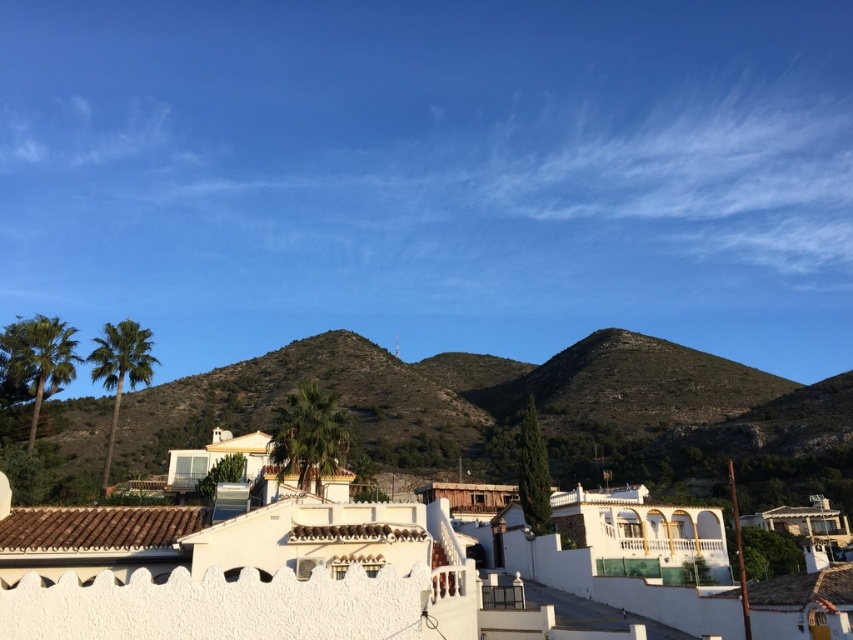
Question: Does green leafy palm tree at center appear over green leafy palm at left?

Choices:
 (A) yes
 (B) no

Answer: (A)

Question: Based on their relative distances, which object is farther from the green leafy palm tree at left?

Choices:
 (A) green textured hillside at center
 (B) green leafy palm at left
 (C) green leafy palm tree at center

Answer: (A)

Question: Can you confirm if green leafy palm tree at center is positioned to the left of green leafy palm tree at left?

Choices:
 (A) yes
 (B) no

Answer: (B)

Question: Which point is closer to the camera?

Choices:
 (A) green leafy palm at left
 (B) green textured hillside at center

Answer: (B)

Question: Is green leafy palm tree at left further to the viewer compared to green leafy palm at left?

Choices:
 (A) yes
 (B) no

Answer: (B)

Question: Estimate the real-world distances between objects in this image. Which object is farther from the green leafy palm tree at left?

Choices:
 (A) green leafy palm tree at center
 (B) green textured hillside at center

Answer: (B)